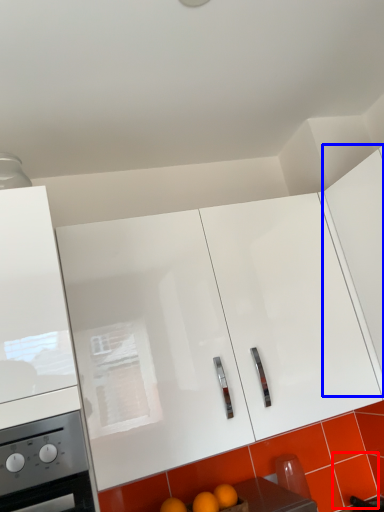
Question: Which point is closer to the camera, tile (highlighted by a red box) or cabinetry (highlighted by a blue box)?

Choices:
 (A) tile
 (B) cabinetry

Answer: (B)